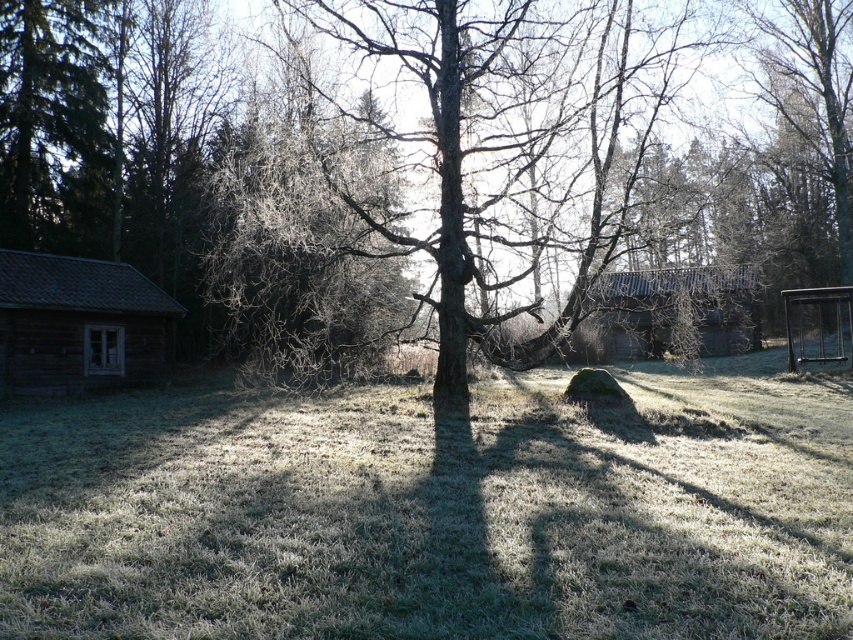
Which of these two, wooden cabin at left or rustic wooden cabin at center, stands taller?

With more height is rustic wooden cabin at center.

Is wooden cabin at left below rustic wooden cabin at center?

No.

Image resolution: width=853 pixels, height=640 pixels. What are the coordinates of `wooden cabin at left` in the screenshot? It's located at (79, 324).

This screenshot has width=853, height=640. What do you see at coordinates (410, 164) in the screenshot? I see `brown rough tree at center` at bounding box center [410, 164].

Is the position of brown rough tree at center more distant than that of rustic wooden cabin at center?

No, brown rough tree at center is closer to the viewer.

Between point (94, 362) and point (723, 273), which one is positioned in front?

Positioned in front is point (94, 362).

The width and height of the screenshot is (853, 640). What are the coordinates of `brown rough tree at center` in the screenshot? It's located at (410, 164).

Which of these two, brown rough tree at center or green grassy at center, stands taller?

With more height is brown rough tree at center.

The image size is (853, 640). Identify the location of brown rough tree at center. (410, 164).

Is point (494, 64) positioned behind point (15, 576)?

Yes, point (494, 64) is farther from viewer.

Where is `brown rough tree at center`? The width and height of the screenshot is (853, 640). brown rough tree at center is located at coordinates (410, 164).